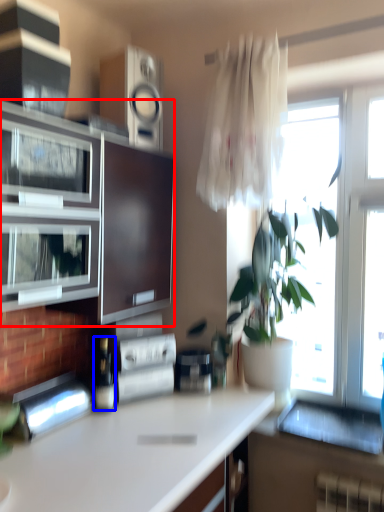
Question: Which point is further to the camera, cabinetry (highlighted by a red box) or bottle (highlighted by a blue box)?

Choices:
 (A) cabinetry
 (B) bottle

Answer: (B)